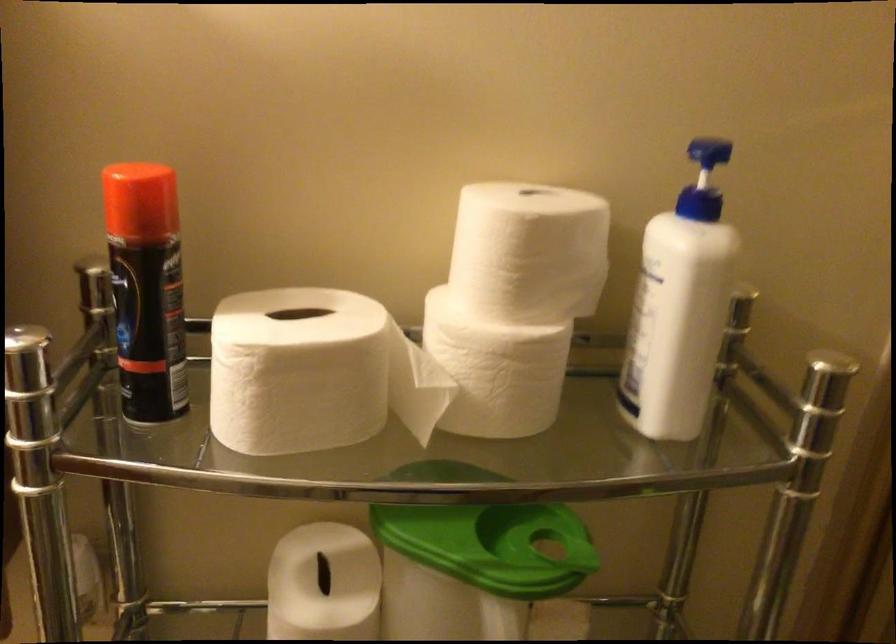
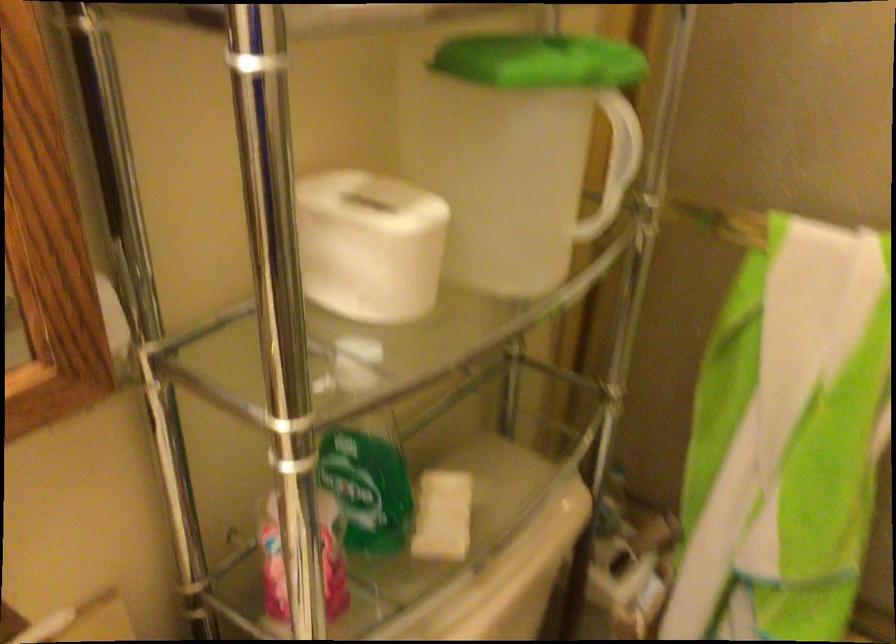
The images are taken continuously from a first-person perspective. In which direction is your viewpoint rotating?

The camera rotated toward right-down.